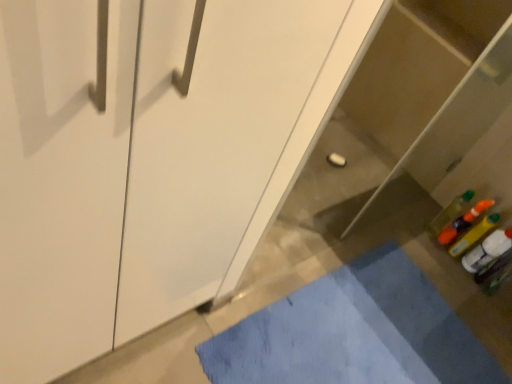
The image size is (512, 384). I want to click on translucent plastic bottle at lower right, so click(x=449, y=213).

This screenshot has width=512, height=384. What do you see at coordinates (354, 333) in the screenshot?
I see `blue fabric bath mat at lower center` at bounding box center [354, 333].

Locate an element on the screen. Image resolution: width=512 pixels, height=384 pixels. translucent plastic bottle at lower right is located at coordinates (449, 213).

Is point (336, 16) behind point (326, 329)?

No, (336, 16) is closer to viewer.

From the image's perspective, relative to blue fabric bath mat at lower center, is white glossy cabinet at center above or below?

white glossy cabinet at center is situated higher than blue fabric bath mat at lower center in the image.

Considering the relative sizes of white glossy cabinet at center and blue fabric bath mat at lower center in the image provided, is white glossy cabinet at center bigger than blue fabric bath mat at lower center?

Yes, white glossy cabinet at center is bigger than blue fabric bath mat at lower center.

From a real-world perspective, which is physically below, white glossy cabinet at center or blue fabric bath mat at lower center?

From a 3D spatial view, blue fabric bath mat at lower center is below.

Is blue fabric bath mat at lower center surrounding white glossy cabinet at center?

No, white glossy cabinet at center is not inside blue fabric bath mat at lower center.

Is blue fabric bath mat at lower center positioned far away from white glossy cabinet at center?

blue fabric bath mat at lower center is actually quite close to white glossy cabinet at center.

Considering the positions of objects blue fabric bath mat at lower center and white glossy cabinet at center in the image provided, who is more to the left, blue fabric bath mat at lower center or white glossy cabinet at center?

white glossy cabinet at center is more to the left.

Considering the sizes of objects blue fabric bath mat at lower center and white glossy cabinet at center in the image provided, who is bigger, blue fabric bath mat at lower center or white glossy cabinet at center?

Bigger between the two is white glossy cabinet at center.

Is translucent plastic bottle at lower right oriented towards blue fabric bath mat at lower center?

No, translucent plastic bottle at lower right is not oriented towards blue fabric bath mat at lower center.

Does translucent plastic bottle at lower right contain blue fabric bath mat at lower center?

No, blue fabric bath mat at lower center is not inside translucent plastic bottle at lower right.

Is translucent plastic bottle at lower right in front of or behind blue fabric bath mat at lower center in the image?

translucent plastic bottle at lower right is behind blue fabric bath mat at lower center.

Is blue fabric bath mat at lower center far from translucent plastic bottle at lower right?

No, there isn't a large distance between blue fabric bath mat at lower center and translucent plastic bottle at lower right.

Looking at this image, considering the sizes of objects blue fabric bath mat at lower center and translucent plastic bottle at lower right in the image provided, who is thinner, blue fabric bath mat at lower center or translucent plastic bottle at lower right?

translucent plastic bottle at lower right is thinner.

Consider the image. Is blue fabric bath mat at lower center facing towards translucent plastic bottle at lower right?

No, blue fabric bath mat at lower center is not facing towards translucent plastic bottle at lower right.

Is point (262, 318) in front of point (460, 210)?

Yes, it is.

Image resolution: width=512 pixels, height=384 pixels. Find the location of `screen door that is below the translucent plastic bottle at lower right (from the image's perspective)`. screen door that is below the translucent plastic bottle at lower right (from the image's perspective) is located at coordinates (209, 140).

Is translucent plastic bottle at lower right oriented towards white glossy cabinet at center?

Yes, translucent plastic bottle at lower right is aimed at white glossy cabinet at center.

Considering the sizes of objects translucent plastic bottle at lower right and white glossy cabinet at center in the image provided, who is taller, translucent plastic bottle at lower right or white glossy cabinet at center?

With more height is white glossy cabinet at center.

Is point (451, 220) positioned after point (257, 11)?

Yes, it is.

From the image's perspective, which is below, white glossy cabinet at center or translucent plastic bottle at lower right?

white glossy cabinet at center appears lower in the image.

Based on the photo, how distant is white glossy cabinet at center from translucent plastic bottle at lower right?

A distance of 4.78 feet exists between white glossy cabinet at center and translucent plastic bottle at lower right.

Is white glossy cabinet at center situated inside translucent plastic bottle at lower right or outside?

white glossy cabinet at center is not enclosed by translucent plastic bottle at lower right.

Find the location of a particular element. bath mat on the right of white glossy cabinet at center is located at coordinates (354, 333).

This screenshot has width=512, height=384. In order to click on screen door above the blue fabric bath mat at lower center (from a real-world perspective) in this screenshot , I will do `click(209, 140)`.

Looking at the image, which one is located closer to translucent plastic bottle at lower right, blue fabric bath mat at lower center or white glossy cabinet at center?

Among the two, blue fabric bath mat at lower center is located nearer to translucent plastic bottle at lower right.

Considering their positions, is white glossy cabinet at center positioned closer to blue fabric bath mat at lower center than translucent plastic bottle at lower right?

translucent plastic bottle at lower right is closer to blue fabric bath mat at lower center.

Considering their positions, is blue fabric bath mat at lower center positioned further to white glossy cabinet at center than translucent plastic bottle at lower right?

Among the two, translucent plastic bottle at lower right is located further to white glossy cabinet at center.

Looking at the image, which one is located closer to translucent plastic bottle at lower right, white glossy cabinet at center or blue fabric bath mat at lower center?

The object closer to translucent plastic bottle at lower right is blue fabric bath mat at lower center.

Considering their positions, is translucent plastic bottle at lower right positioned further to blue fabric bath mat at lower center than white glossy cabinet at center?

The object further to blue fabric bath mat at lower center is white glossy cabinet at center.

Based on the photo, when comparing their distances from white glossy cabinet at center, does translucent plastic bottle at lower right or blue fabric bath mat at lower center seem further?

translucent plastic bottle at lower right.

At what (x,y) coordinates should I click in order to perform the action: click on bath mat located between white glossy cabinet at center and translucent plastic bottle at lower right in the depth direction. Please return your answer as a coordinate pair (x, y). Looking at the image, I should click on (354, 333).